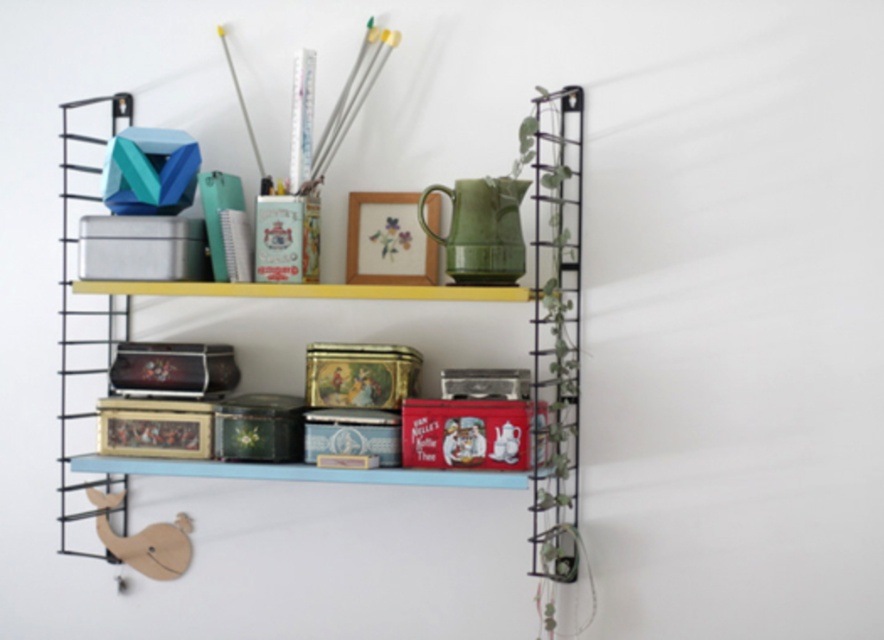
What are the coordinates of `metallic tin at upper center` in the screenshot? It's located at (418, 300).

How distant is metallic tin at upper center from metallic tin cans at center?

The distance of metallic tin at upper center from metallic tin cans at center is 2.34 inches.

The image size is (884, 640). What do you see at coordinates (418, 300) in the screenshot?
I see `metallic tin at upper center` at bounding box center [418, 300].

Identify the location of metallic tin at upper center. (418, 300).